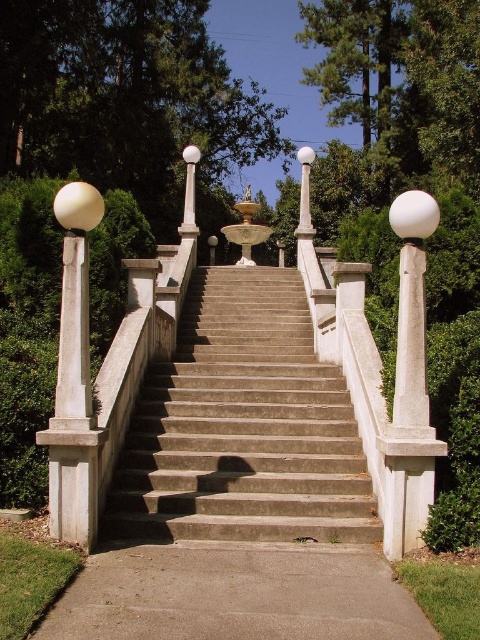
Between concrete stairs at center and gray concrete sidewalk at lower center, which one has more height?

concrete stairs at center is taller.

Describe the element at coordinates (241, 428) in the screenshot. I see `concrete stairs at center` at that location.

Is point (280, 387) less distant than point (383, 620)?

No, (280, 387) is further to viewer.

Where is `concrete stairs at center`? Image resolution: width=480 pixels, height=640 pixels. concrete stairs at center is located at coordinates (241, 428).

Who is positioned more to the left, green leafy tree at upper center or gray concrete sidewalk at lower center?

Positioned to the left is green leafy tree at upper center.

Does green leafy tree at upper center lie behind gray concrete sidewalk at lower center?

Yes, it is.

You are a GUI agent. You are given a task and a screenshot of the screen. Output one action in this format:
    pyautogui.click(x=<x>, y=<y>)
    Task: Click on the green leafy tree at upper center
    This screenshot has height=640, width=480.
    Given the screenshot: What is the action you would take?
    pyautogui.click(x=128, y=100)

Identify the location of concrete stairs at center. (241, 428).

Is concrete stairs at center to the left of green leafy tree at upper center from the viewer's perspective?

No, concrete stairs at center is not to the left of green leafy tree at upper center.

The image size is (480, 640). I want to click on concrete stairs at center, so click(x=241, y=428).